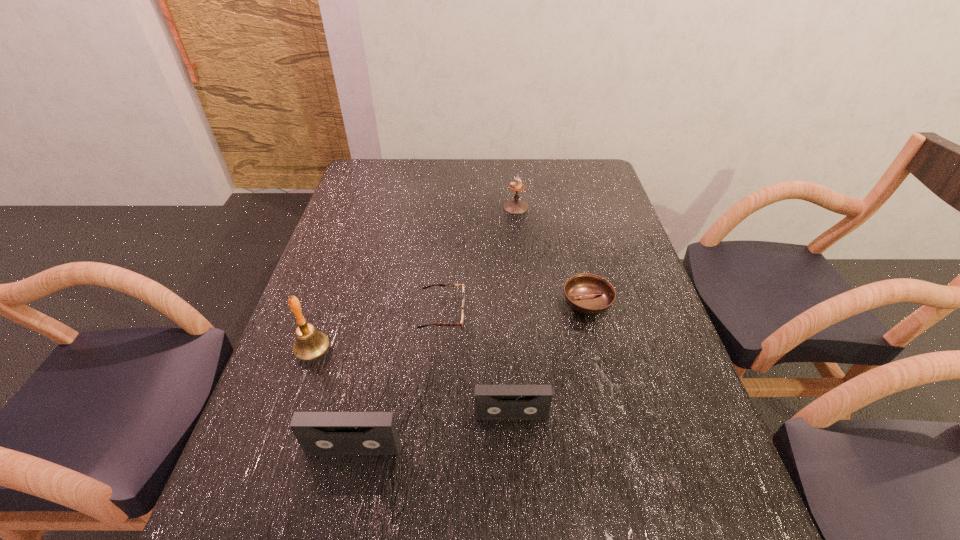
I want to click on object present at the near left corner, so click(x=319, y=433).

Identify the location of free space at the far edge of the desktop. The width and height of the screenshot is (960, 540). (485, 169).

The image size is (960, 540). Find the location of `vacant position at the near edge of the desktop`. vacant position at the near edge of the desktop is located at coordinates (437, 473).

In the image, there is a desktop. At what (x,y) coordinates should I click in order to perform the action: click on vacant area at the left edge. Please return your answer as a coordinate pair (x, y). Looking at the image, I should click on (322, 274).

Where is `vacant region at the right edge of the desktop`? vacant region at the right edge of the desktop is located at coordinates (618, 397).

At what (x,y) coordinates should I click in order to perform the action: click on blank area at the far left corner. Please return your answer as a coordinate pair (x, y). This screenshot has height=540, width=960. Looking at the image, I should click on (374, 187).

Where is `free space at the far right corner`? The height and width of the screenshot is (540, 960). free space at the far right corner is located at coordinates (573, 166).

Image resolution: width=960 pixels, height=540 pixels. In order to click on free space between the third object from left to right and the candle holder in this screenshot , I will do `click(479, 260)`.

This screenshot has height=540, width=960. What are the coordinates of `free space between the candle holder and the farther videotape` in the screenshot? It's located at 514,311.

I want to click on free area in between the rightmost object and the taller videotape, so click(x=470, y=375).